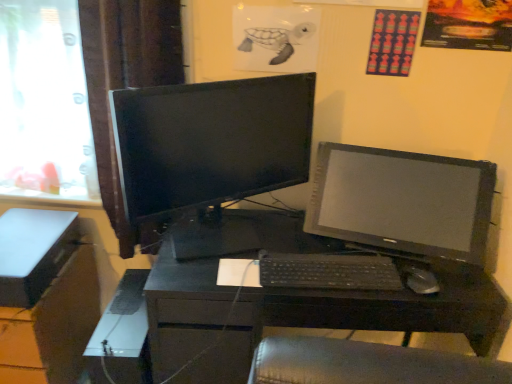
Find the location of a particular element. This screenshot has height=384, width=512. free location to the left of black plastic keyboard at center is located at coordinates (237, 254).